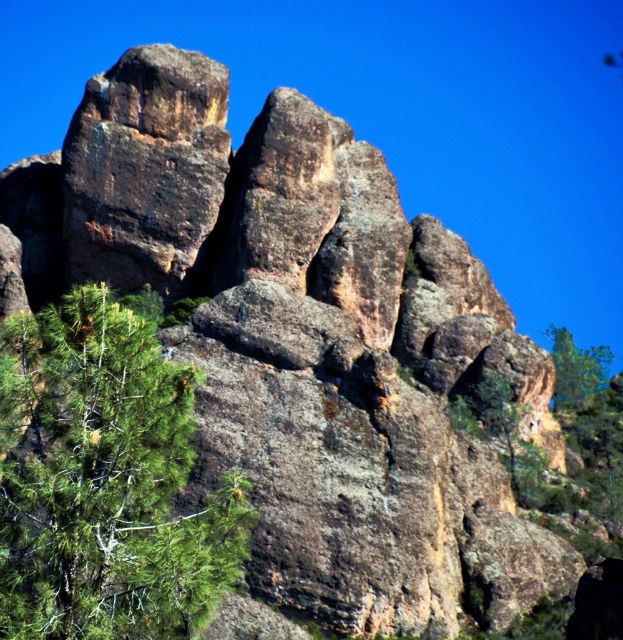
Question: Is green leafy tree at lower left bigger than green leafy tree at upper right?

Choices:
 (A) no
 (B) yes

Answer: (A)

Question: Which point appears farthest from the camera in this image?

Choices:
 (A) (156, 461)
 (B) (564, 344)

Answer: (B)

Question: Is green leafy tree at lower left bigger than green leafy tree at upper right?

Choices:
 (A) no
 (B) yes

Answer: (A)

Question: Among these objects, which one is farthest from the camera?

Choices:
 (A) green leafy tree at lower left
 (B) green leafy tree at upper right

Answer: (B)

Question: Considering the relative positions of green leafy tree at lower left and green leafy tree at upper right in the image provided, where is green leafy tree at lower left located with respect to green leafy tree at upper right?

Choices:
 (A) right
 (B) left

Answer: (B)

Question: Which point appears farthest from the camera in this image?

Choices:
 (A) (148, 372)
 (B) (554, 333)

Answer: (B)